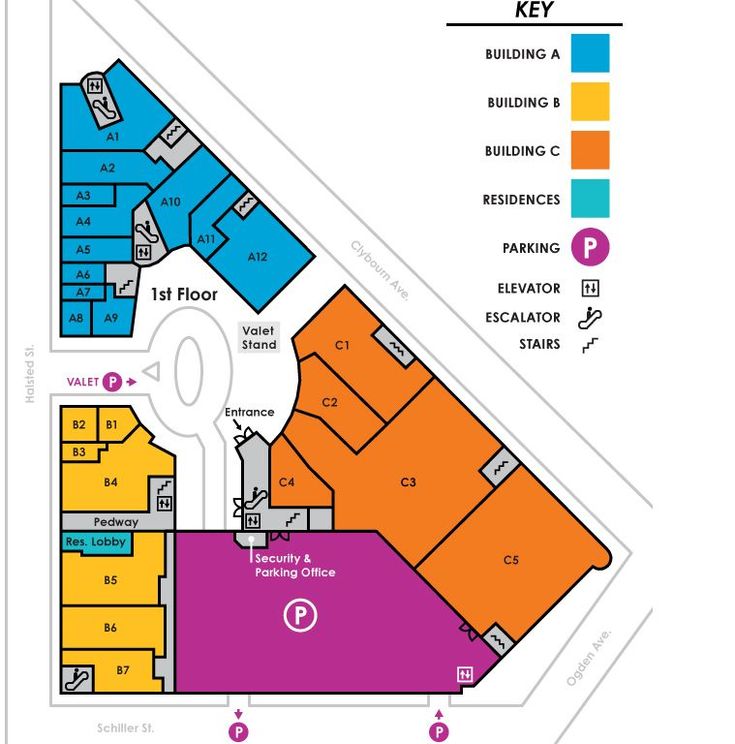
Find the location of a particular element. stairs is located at coordinates (176, 129), (245, 205), (126, 286), (159, 487), (290, 518), (497, 635), (498, 469), (395, 350).